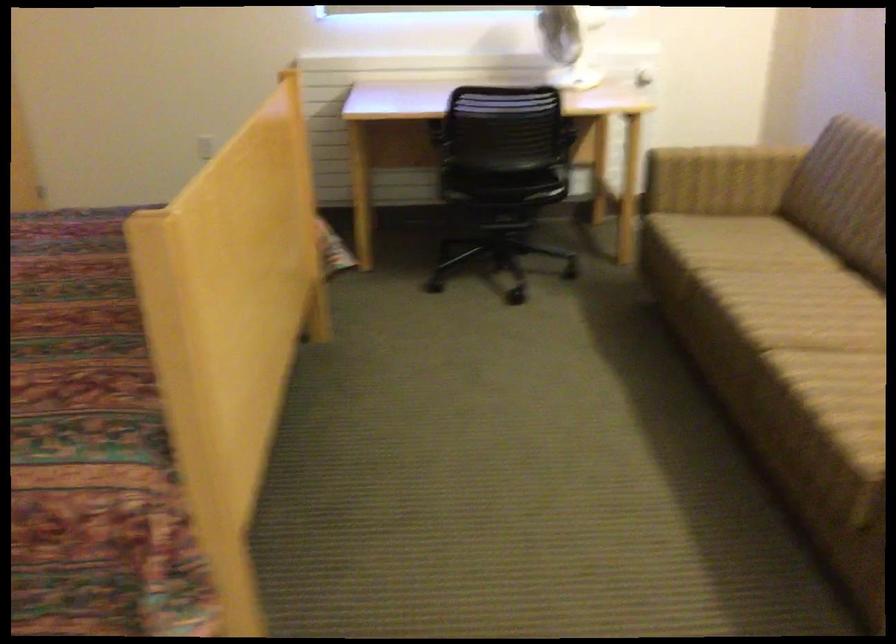
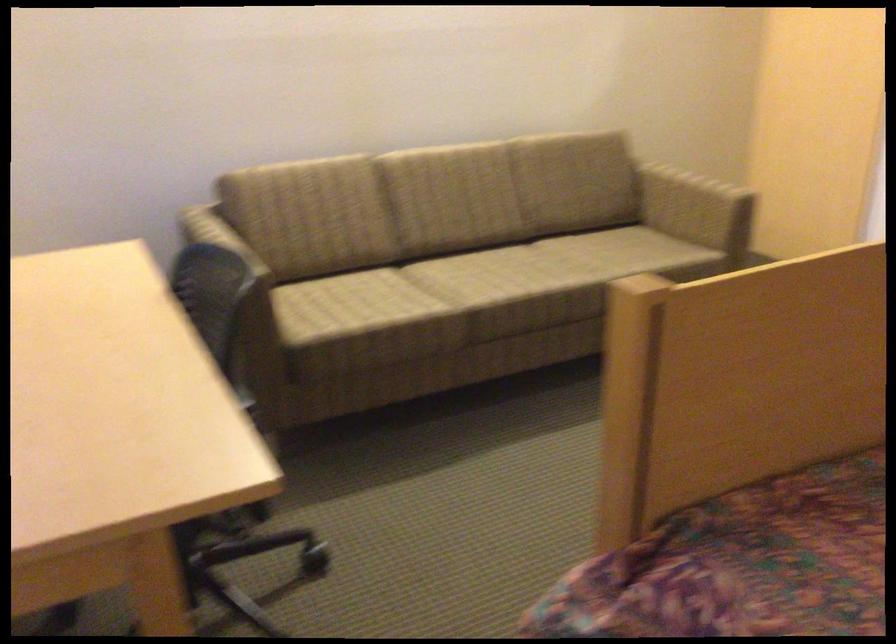
Where in the second image is the point corresponding to [789,290] from the first image?

(470, 279)